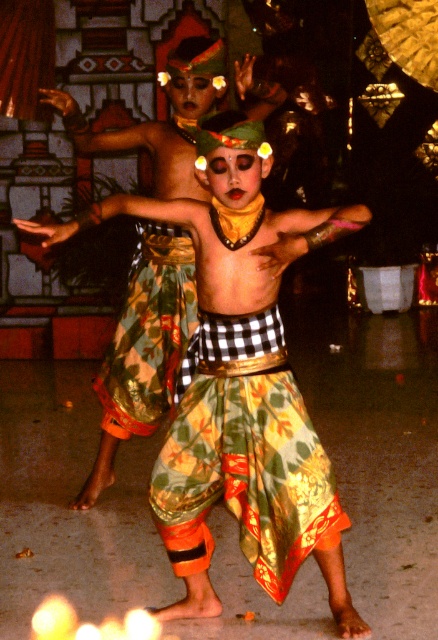
Question: From the image, what is the correct spatial relationship of printed silk skirt at center in relation to printed fabric dancer at center?

Choices:
 (A) left
 (B) right

Answer: (B)

Question: Which point is closer to the camera?

Choices:
 (A) printed silk skirt at center
 (B) printed fabric dancer at center

Answer: (A)

Question: Which of the following is the farthest from the observer?

Choices:
 (A) (82, 486)
 (B) (271, 317)

Answer: (A)

Question: Does printed silk skirt at center appear over printed fabric dancer at center?

Choices:
 (A) no
 (B) yes

Answer: (A)

Question: Is printed silk skirt at center positioned behind printed fabric dancer at center?

Choices:
 (A) no
 (B) yes

Answer: (A)